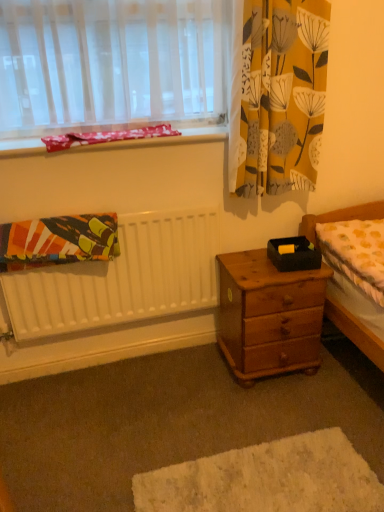
Where is `free region under textured cotton blanket at left (from a real-world perspective)`? free region under textured cotton blanket at left (from a real-world perspective) is located at coordinates (70, 379).